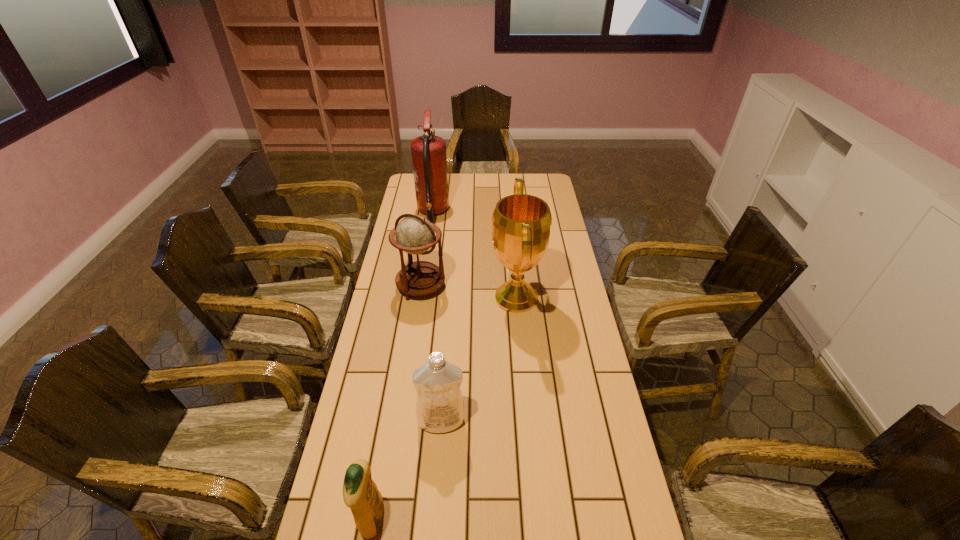
Locate an element on the screen. The image size is (960, 540). vacant area that lies between the right detergent and the third tallest object is located at coordinates (431, 354).

Select which object is the third closest to the fire extinguisher. Please provide its 2D coordinates. Your answer should be formatted as a tuple, i.e. [(x, y)], where the tuple contains the x and y coordinates of a point satisfying the conditions above.

[(439, 404)]

You are a GUI agent. You are given a task and a screenshot of the screen. Output one action in this format:
    pyautogui.click(x=<x>, y=<y>)
    Task: Click on the object that ranks as the third closest to the left detergent
    
    Given the screenshot: What is the action you would take?
    pyautogui.click(x=414, y=234)

Locate an element on the screen. This screenshot has width=960, height=540. vacant space that satisfies the following two spatial constraints: 1. at the front of the farthest object where the nozzle is aimed; 2. on the back side of the right detergent is located at coordinates coord(402,421).

This screenshot has width=960, height=540. What are the coordinates of `free space that satisfies the following two spatial constraints: 1. on the surface of the globe; 2. on the left side of the right detergent` in the screenshot? It's located at (401, 421).

The image size is (960, 540). Identify the location of free spot that satisfies the following two spatial constraints: 1. on the surface of the third tallest object; 2. on the right side of the farther detergent. (401, 421).